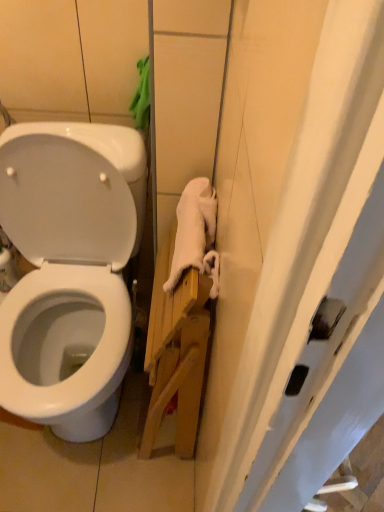
Question: Is white soft towel at right bigger or smaller than white glossy toilet at upper left?

Choices:
 (A) small
 (B) big

Answer: (A)

Question: In the image, is white soft towel at right on the left side or the right side of white glossy toilet at upper left?

Choices:
 (A) left
 (B) right

Answer: (B)

Question: Which object is positioned closest to the white soft towel at right?

Choices:
 (A) white glossy toilet at upper left
 (B) white glossy toilet at left

Answer: (A)

Question: Which is farther from the white soft towel at right?

Choices:
 (A) white glossy toilet at upper left
 (B) white glossy toilet at left

Answer: (B)